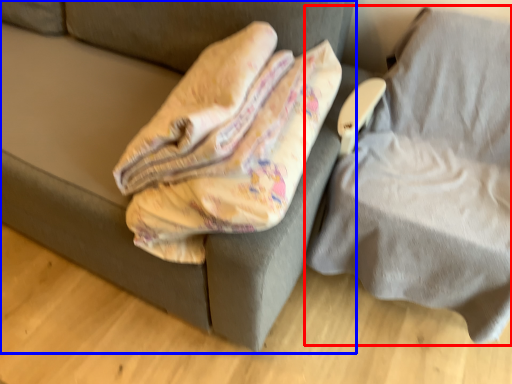
Question: Among these objects, which one is farthest to the camera, furniture (highlighted by a red box) or furniture (highlighted by a blue box)?

Choices:
 (A) furniture
 (B) furniture

Answer: (B)